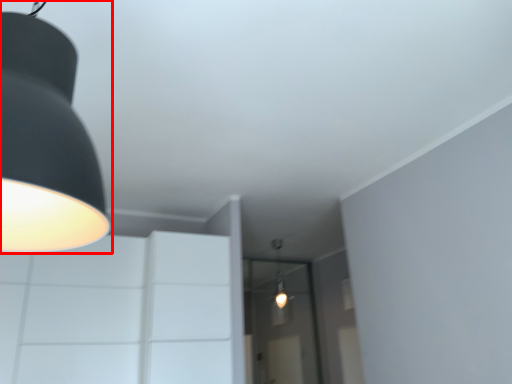
Question: From the image's perspective, considering the relative positions of lamp (annotated by the red box) and glass door in the image provided, where is lamp (annotated by the red box) located with respect to the staircase?

Choices:
 (A) below
 (B) above

Answer: (B)